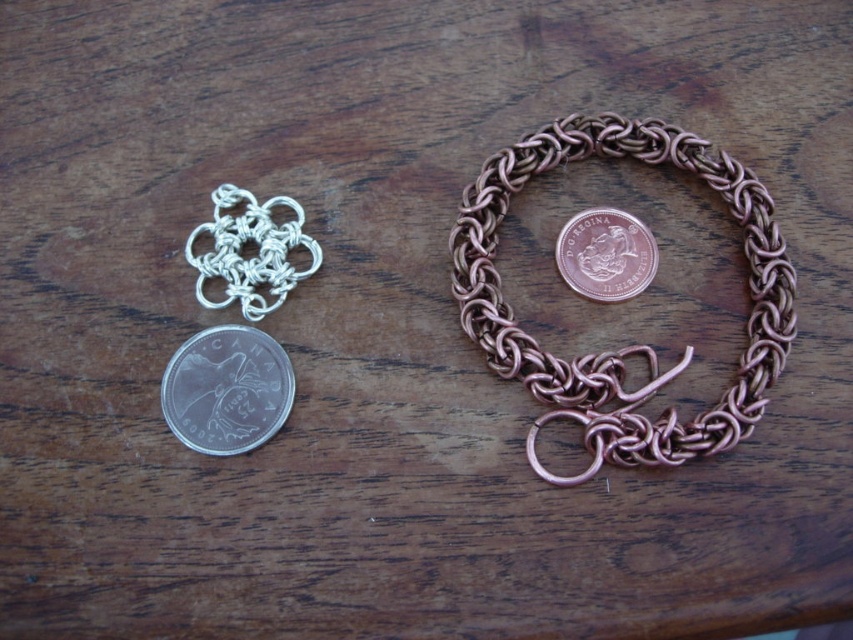
What is the spatial relationship between the copper wire bracelet at center and the rose gold metallic coin at center in the image?

The copper wire bracelet at center is closer to the viewer than the rose gold metallic coin at center.

You are standing at the edge of the wooden surface and want to pick up both the silver metallic coin at lower left and the British penny at lower right. If you can only reach 1 meter with your hand, will you be able to grab both coins without moving your position?

The coins are 1.33 meters apart, which is farther than your reach of 1 meter. You won t be able to grab both coins without moving your position.

You are an archaeologist examining the wooden surface. You notice the copper wire bracelet at center and the silver metallic coin at lower left. Which object is closer to you?

The copper wire bracelet at center is closer to you because it is positioned in front of the silver metallic coin at lower left.